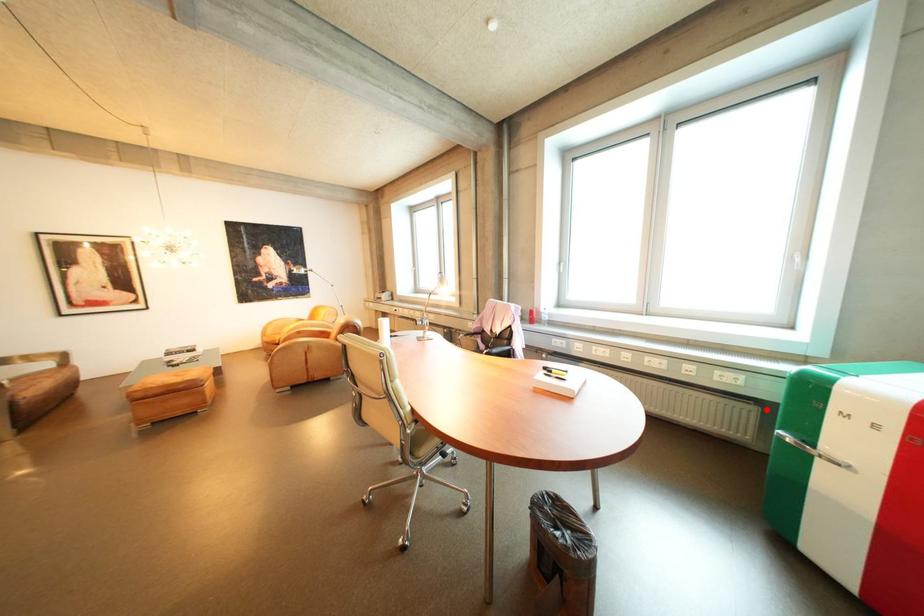
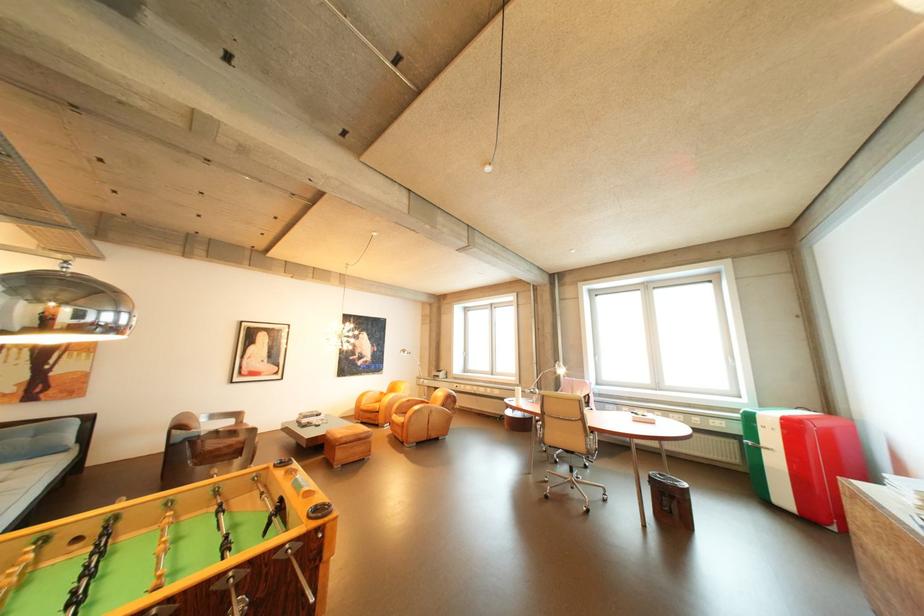
In the second image, find the point that corresponds to the highlighted location in the first image.

(748, 443)